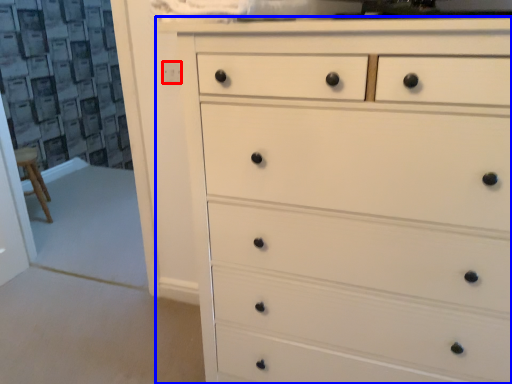
Question: Which point is further to the camera, knob (highlighted by a red box) or chest of drawers (highlighted by a blue box)?

Choices:
 (A) knob
 (B) chest of drawers

Answer: (A)